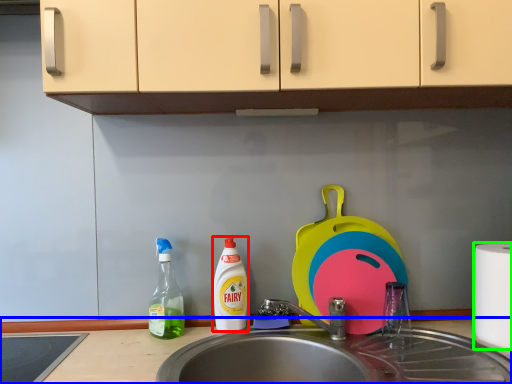
Question: Which object is positioned farthest from cleaning product (highlighted by a red box)? Select from countertop (highlighted by a blue box) and paper towel (highlighted by a green box).

Choices:
 (A) countertop
 (B) paper towel

Answer: (B)